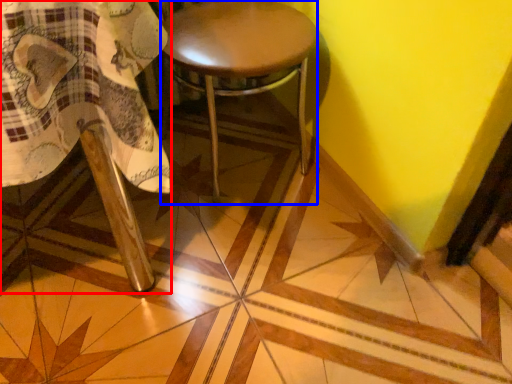
Question: Among these objects, which one is nearest to the camera, chair (highlighted by a red box) or stool (highlighted by a blue box)?

Choices:
 (A) chair
 (B) stool

Answer: (A)